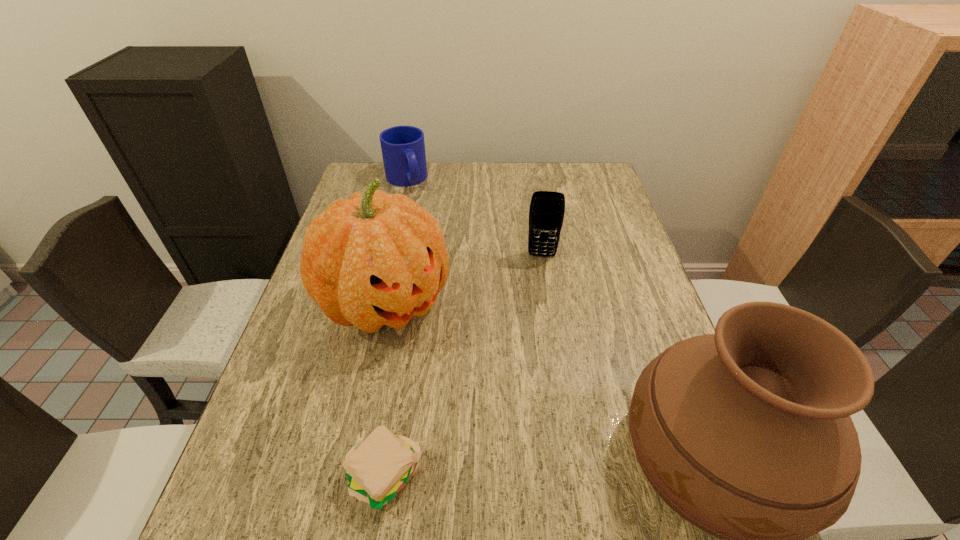
Image resolution: width=960 pixels, height=540 pixels. In order to click on object that is the closest to the third tallest object in this screenshot , I will do `click(376, 259)`.

Select which object is the fourth closest to the farthest object. Please provide its 2D coordinates. Your answer should be formatted as a tuple, i.e. [(x, y)], where the tuple contains the x and y coordinates of a point satisfying the conditions above.

[(380, 468)]

The image size is (960, 540). Find the location of `vacant space that satisfies the following two spatial constraints: 1. on the back side of the patty; 2. on the right side of the second object from right to left`. vacant space that satisfies the following two spatial constraints: 1. on the back side of the patty; 2. on the right side of the second object from right to left is located at coordinates (419, 255).